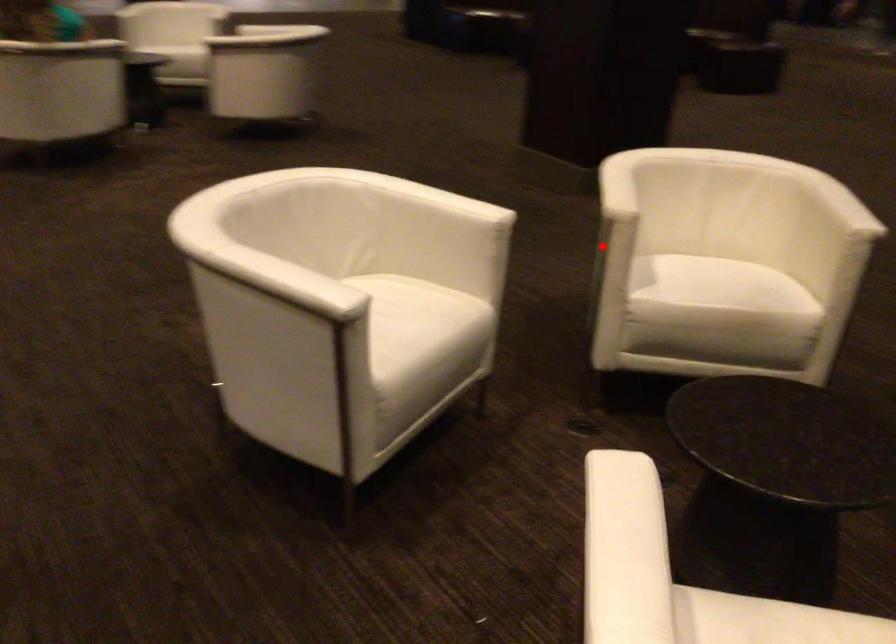
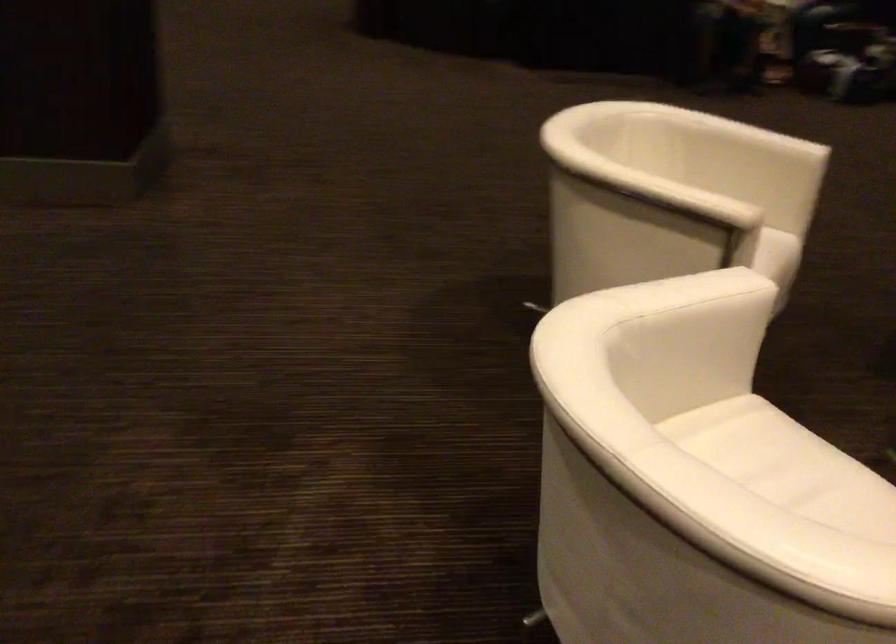
Question: I am providing you with two images of the same scene from different viewpoints. In image1, a red point is highlighted. Considering the same 3D point in image2, which of the following is correct?

Choices:
 (A) It is closer
 (B) It is farther

Answer: (A)